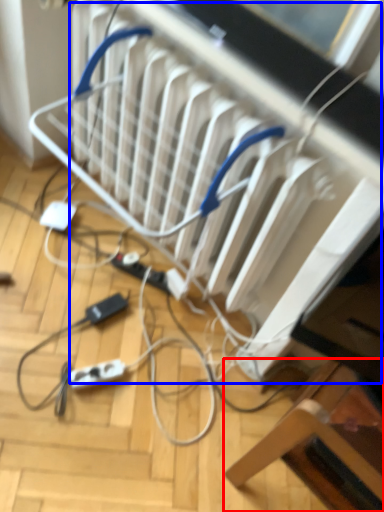
Question: Among these objects, which one is nearest to the camera, furniture (highlighted by a red box) or radiator (highlighted by a blue box)?

Choices:
 (A) furniture
 (B) radiator

Answer: (A)